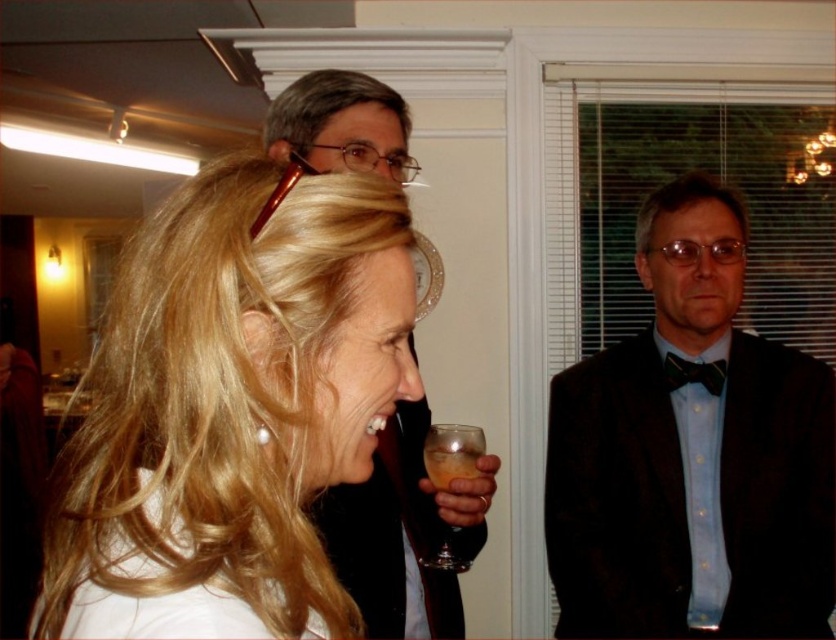
Is dark blue satin bow tie at right to the right of multicolored satin bow tie at right from the viewer's perspective?

Correct, you'll find dark blue satin bow tie at right to the right of multicolored satin bow tie at right.

Does dark blue satin bow tie at right have a lesser width compared to multicolored satin bow tie at right?

In fact, dark blue satin bow tie at right might be wider than multicolored satin bow tie at right.

In order to click on dark blue satin bow tie at right in this screenshot , I will do `click(691, 454)`.

Who is shorter, translucent glass at lower center or multicolored satin bow tie at right?

multicolored satin bow tie at right

Does translucent glass at lower center appear under multicolored satin bow tie at right?

Correct, translucent glass at lower center is located below multicolored satin bow tie at right.

Is point (445, 470) closer to viewer compared to point (711, 378)?

Yes, point (445, 470) is in front of point (711, 378).

Where is `translucent glass at lower center`? translucent glass at lower center is located at coordinates (452, 452).

How much distance is there between translucent amber liquid at lower center and multicolored satin bow tie at right?

translucent amber liquid at lower center is 26.89 inches from multicolored satin bow tie at right.

Is translucent amber liquid at lower center to the left of multicolored satin bow tie at right from the viewer's perspective?

Yes, translucent amber liquid at lower center is to the left of multicolored satin bow tie at right.

You are a GUI agent. You are given a task and a screenshot of the screen. Output one action in this format:
    pyautogui.click(x=<x>, y=<y>)
    Task: Click on the translucent amber liquid at lower center
    The image size is (836, 640).
    Given the screenshot: What is the action you would take?
    pyautogui.click(x=451, y=458)

Image resolution: width=836 pixels, height=640 pixels. I want to click on translucent amber liquid at lower center, so click(451, 458).